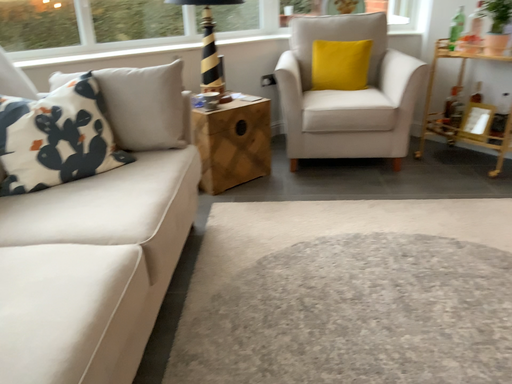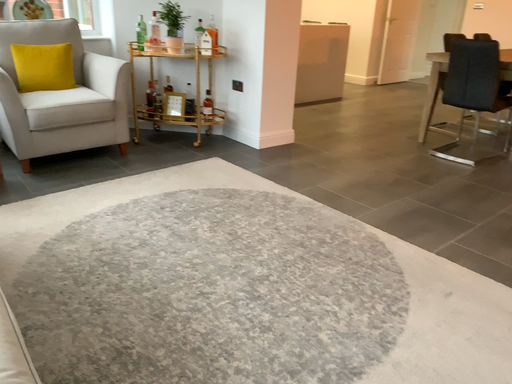
Question: Which way did the camera rotate in the video?

Choices:
 (A) rotated left
 (B) rotated right

Answer: (B)